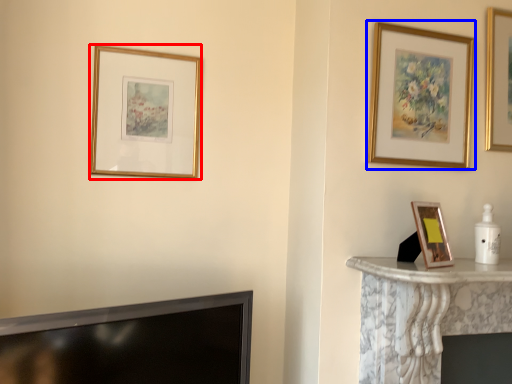
Question: Which object is further to the camera taking this photo, picture frame (highlighted by a red box) or picture frame (highlighted by a blue box)?

Choices:
 (A) picture frame
 (B) picture frame

Answer: (A)